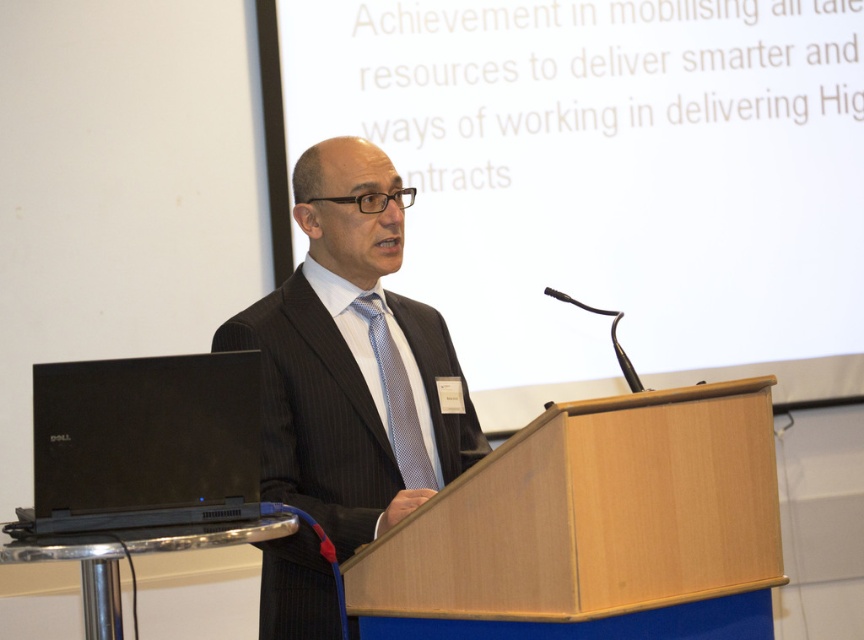
Question: Can you confirm if wooden podium at center is positioned to the left of dark pinstripe suit at center?

Choices:
 (A) yes
 (B) no

Answer: (B)

Question: Does wooden podium at center appear on the left side of dark pinstripe suit at center?

Choices:
 (A) no
 (B) yes

Answer: (A)

Question: Is black matte laptop at lower left above blue dotted tie at center?

Choices:
 (A) yes
 (B) no

Answer: (B)

Question: Among these points, which one is nearest to the camera?

Choices:
 (A) (383, 394)
 (B) (169, 449)

Answer: (B)

Question: Which of the following is the farthest from the observer?

Choices:
 (A) (236, 342)
 (B) (420, 470)
 (C) (121, 515)
 (D) (722, 506)

Answer: (B)

Question: Considering the real-world distances, which object is farthest from the wooden podium at center?

Choices:
 (A) blue dotted tie at center
 (B) black matte laptop at lower left
 (C) dark pinstripe suit at center

Answer: (B)